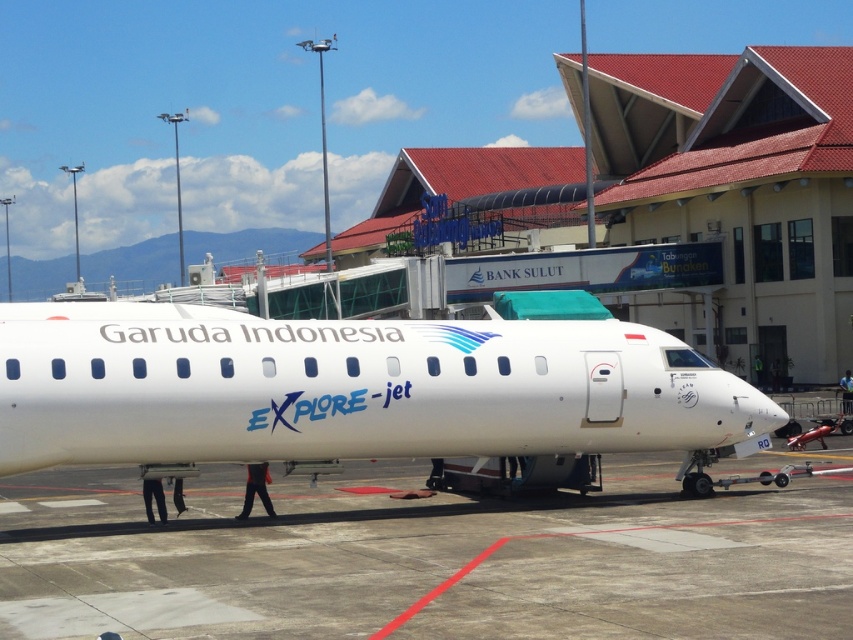
Question: Considering the relative positions of concrete at center and white glossy airplane at center in the image provided, where is concrete at center located with respect to white glossy airplane at center?

Choices:
 (A) above
 (B) below

Answer: (B)

Question: Which point is farther to the camera?

Choices:
 (A) tap(746, 516)
 (B) tap(33, 330)

Answer: (B)

Question: Which of the following is the closest to the observer?

Choices:
 (A) (16, 413)
 (B) (751, 460)

Answer: (A)

Question: Is concrete at center in front of white glossy airplane at center?

Choices:
 (A) yes
 (B) no

Answer: (A)

Question: Among these objects, which one is nearest to the camera?

Choices:
 (A) concrete at center
 (B) white glossy airplane at center

Answer: (A)

Question: Does concrete at center appear over white glossy airplane at center?

Choices:
 (A) yes
 (B) no

Answer: (B)